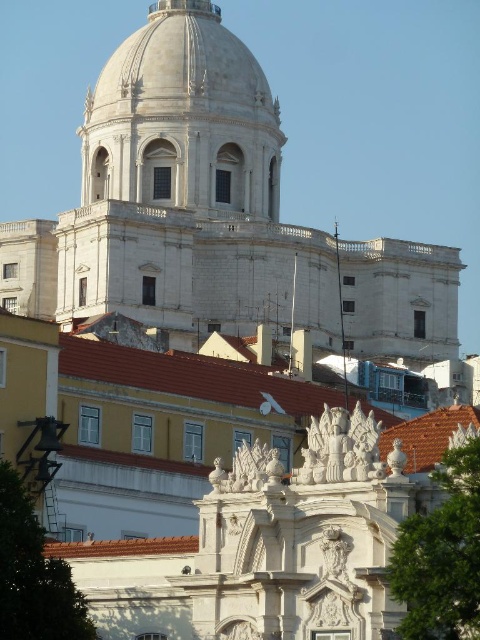
You are an architect visiting Lisbon and want to take a photo of the white marble dome at upper center without any obstructions. However, there is a green leafy tree at lower left in the scene. Based on their positions, will the tree block your view of the dome?

The green leafy tree at lower left is behind the white marble dome at upper center, so it will not block your view of the dome.

You are standing in front of the historic buildings in Lisbon. You notice a white marble dome at upper center and a green leafy tree at lower left. Which of these two objects is positioned higher in the image?

The white marble dome at upper center is located above the green leafy tree at lower left, so it is positioned higher in the image.